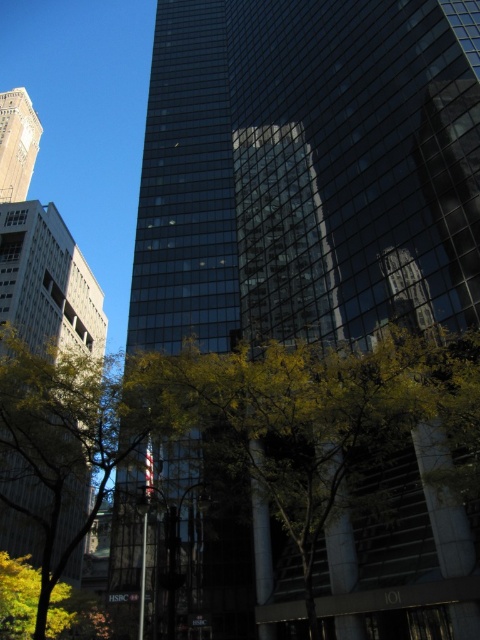
Question: Which point is closer to the camera?

Choices:
 (A) (238, 420)
 (B) (76, 300)
 (C) (27, 138)

Answer: (A)

Question: Which is farther from the white concrete building at left?

Choices:
 (A) green leafy tree at center
 (B) matte gold clock tower at upper left

Answer: (B)

Question: Is green leafy tree at center to the right of white concrete building at left from the viewer's perspective?

Choices:
 (A) no
 (B) yes

Answer: (B)

Question: Does white concrete building at left have a greater width compared to matte gold clock tower at upper left?

Choices:
 (A) no
 (B) yes

Answer: (A)

Question: Is green leafy tree at center bigger than white concrete building at left?

Choices:
 (A) yes
 (B) no

Answer: (B)

Question: Which object is farther from the camera taking this photo?

Choices:
 (A) matte gold clock tower at upper left
 (B) white concrete building at left

Answer: (A)